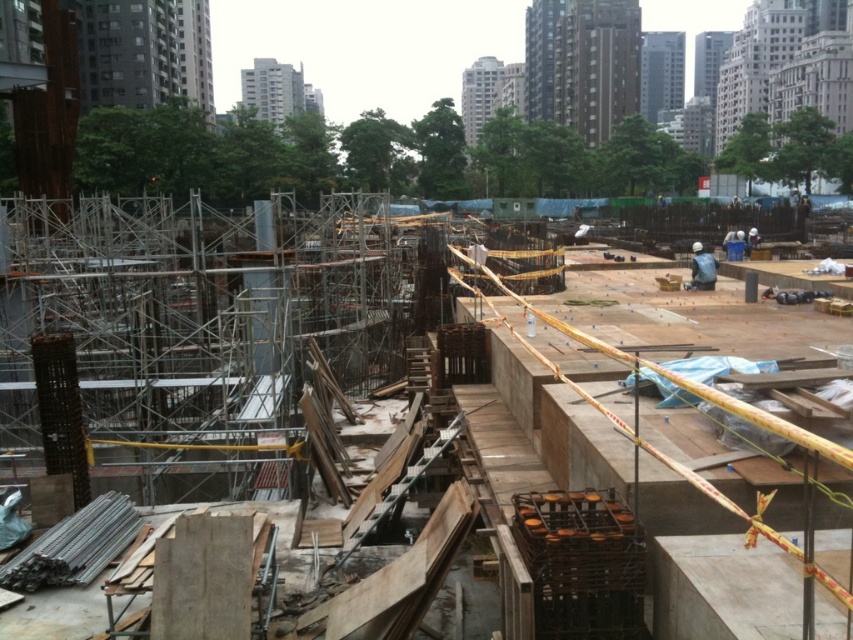
You are a safety inspector at the construction site. You need to ensure that the concrete scaffolding at center and the concrete at center are properly secured. Which one requires more attention in terms of stability due to its size?

The concrete scaffolding at center has a larger size compared to concrete at center, so it requires more attention in terms of stability because larger structures are more prone to instability and require thorough inspection.

From the picture: You are a construction worker standing at the point with coordinates point (144, 337). What object are you standing on?

You are standing on the concrete scaffolding at center.

You are a safety inspector standing at the edge of the construction site. You need to check the distance between the concrete scaffolding at center and the blue fabric construction worker at center. According to safety regulations, workers must stay at least 15 meters away from unstable scaffolding. Is the current distance compliant with the safety standards?

The concrete scaffolding at center is 13.34 meters away from the blue fabric construction worker at center. Since the required distance is 15 meters, the current distance is not compliant with safety standards.